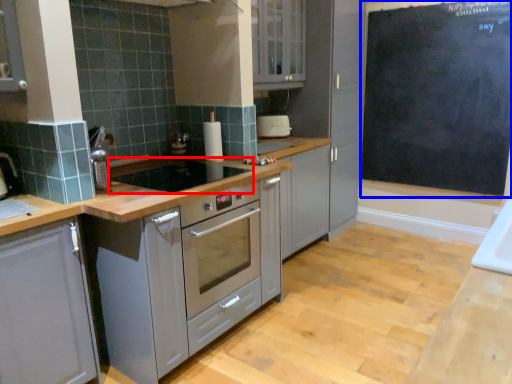
Question: Which point is closer to the camera, gas stove (highlighted by a red box) or bulletin board (highlighted by a blue box)?

Choices:
 (A) gas stove
 (B) bulletin board

Answer: (A)